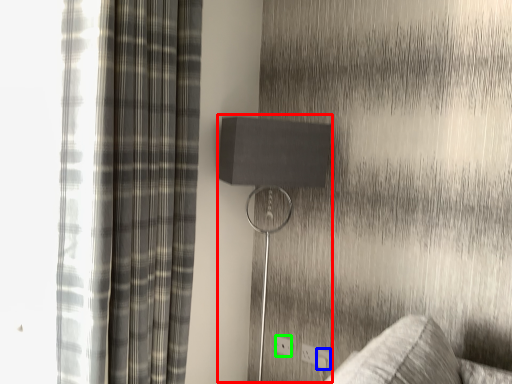
Question: Based on their relative distances, which object is farther from table lamp (highlighted by a red box)? Choose from electric outlet (highlighted by a blue box) and electric outlet (highlighted by a green box).

Choices:
 (A) electric outlet
 (B) electric outlet

Answer: (A)